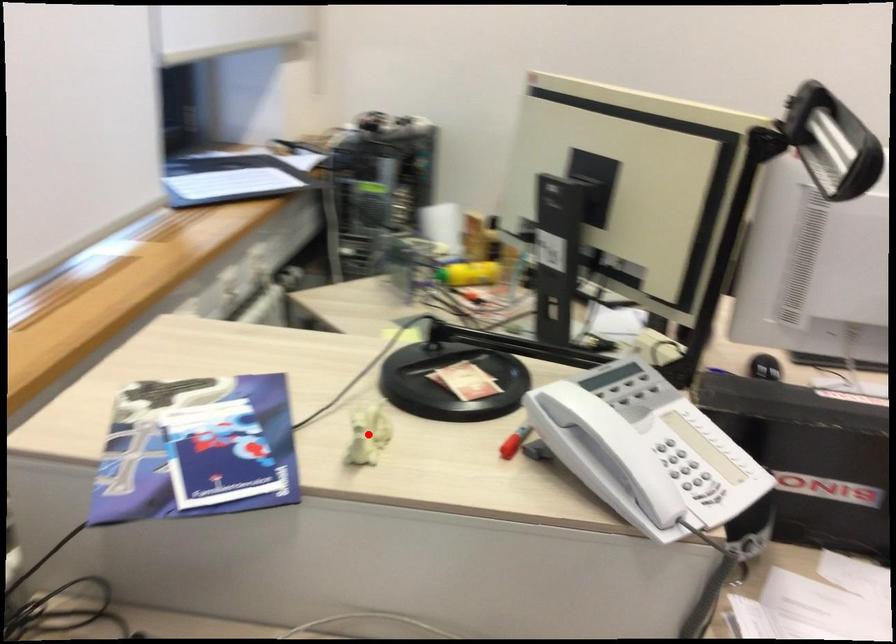
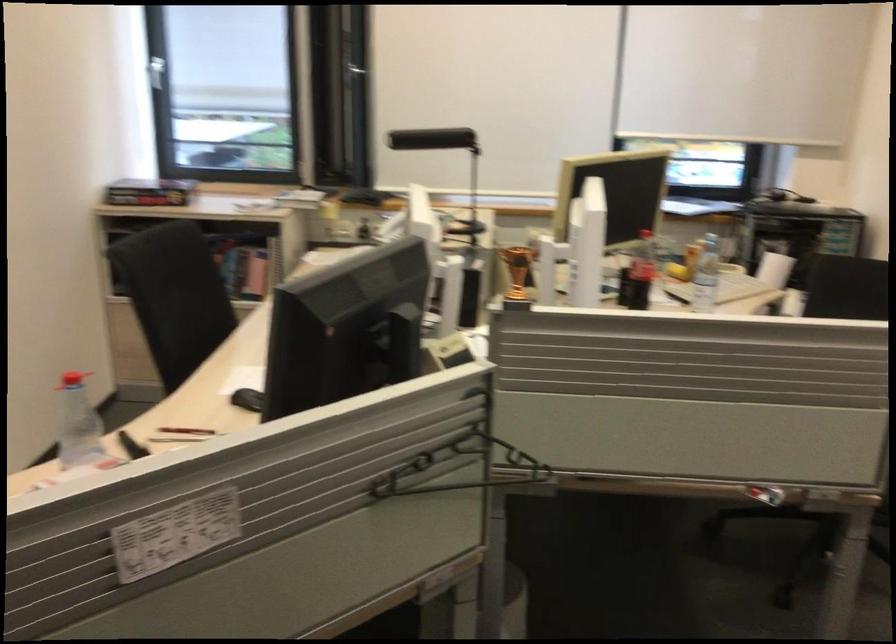
Question: I am providing you with two images of the same scene from different viewpoints. A red point is marked on the first image. At the location where the point appears in image 1, is it still visible in image 2?

Choices:
 (A) Yes
 (B) No

Answer: (B)